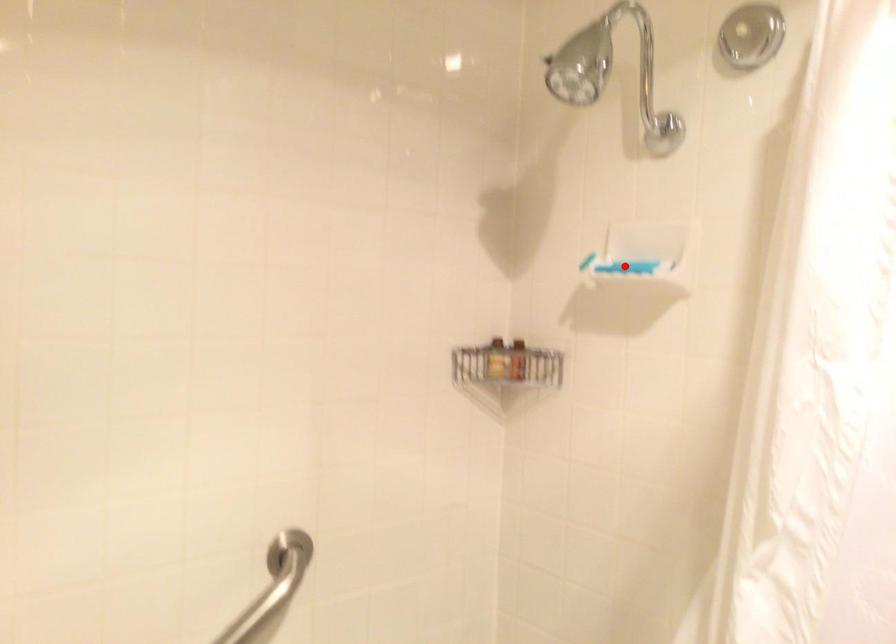
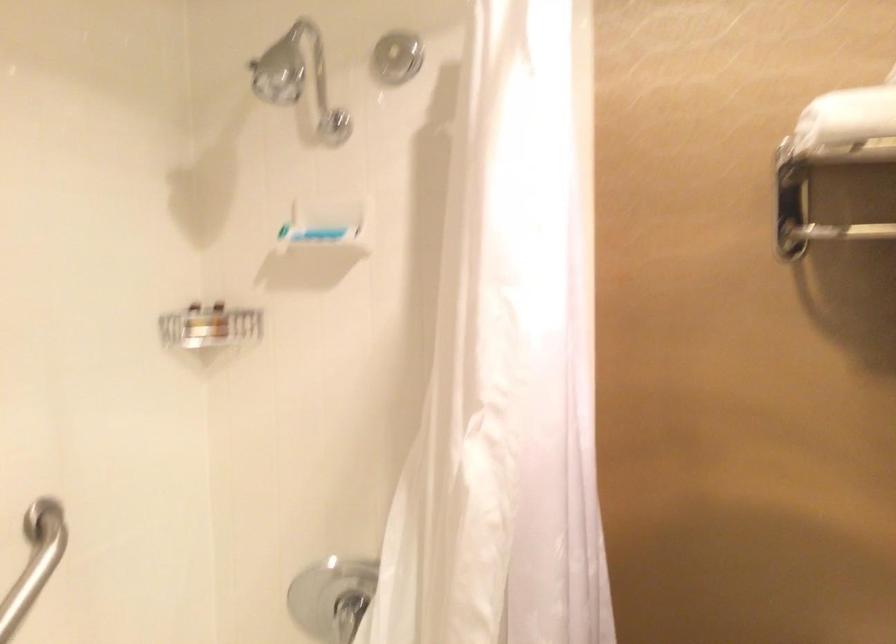
Question: I am providing you with two images of the same scene from different viewpoints. Image1 has a red point marked. In image2, the corresponding 3D location appears at what relative position? Reply with the corresponding letter.

Choices:
 (A) Closer
 (B) Farther

Answer: (B)